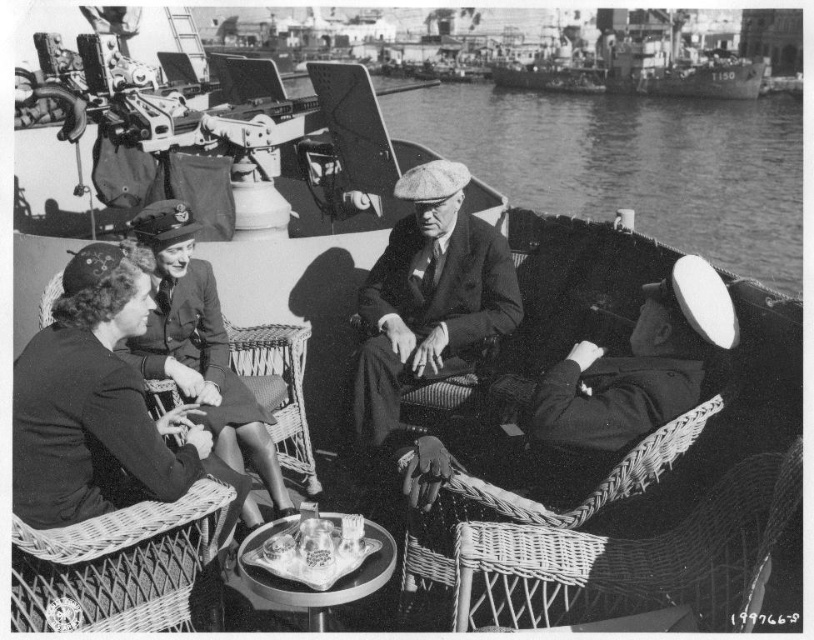
You are a photographer analyzing this historical image. You notice the clear water at center and the dark woolen coat at lower left. Based on their positions, which object is located to the right of the other?

The clear water at center is positioned on the right side of dark woolen coat at lower left, so the clear water at center is to the right of the dark woolen coat at lower left.

You are on a ship deck and need to retrieve an item from the table. The dark woolen coat at lower left and the matte black uniform at center are in your way. Which object should you move first to access the table?

You should move the dark woolen coat at lower left first because it is in front of the matte black uniform at center, making it closer to you and easier to access.

You are a photographer analyzing this historical image. You notice two points marked on the deck of the ship. The first point is at coordinates point (x=469, y=157) and the second point is at point (x=103, y=296). Based on the perspective in the image, which of these points is closer to the camera?

Point (x=469, y=157) is closer to the camera than point (x=103, y=296) because it is further to the viewer in the image perspective.